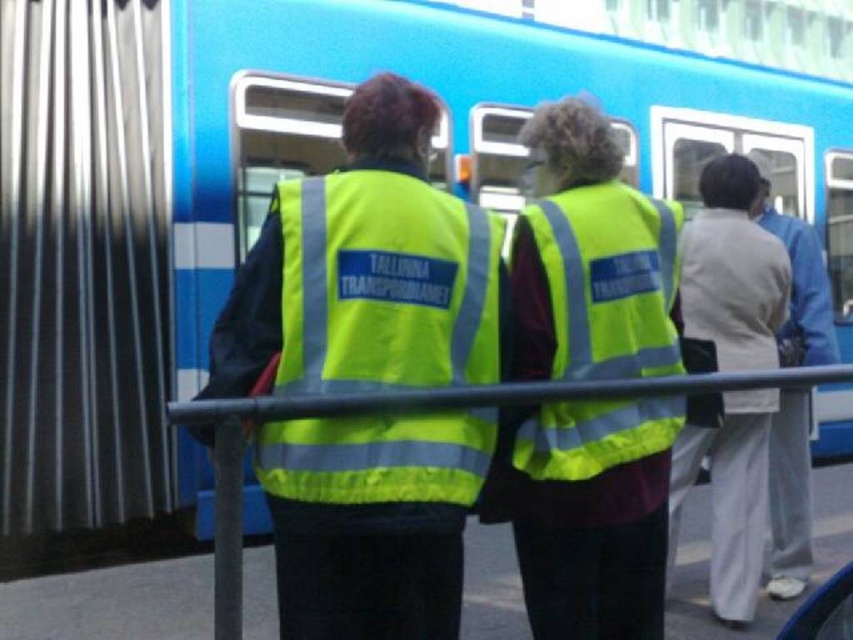
Can you confirm if white cotton pants at right is positioned above reflective plastic rail at center?

Yes.

Does point (740, 236) lie behind point (264, 406)?

Yes, point (740, 236) is behind point (264, 406).

The image size is (853, 640). Identify the location of white cotton pants at right. (732, 269).

Is neon yellow reflective vest at center thinner than white cotton pants at right?

In fact, neon yellow reflective vest at center might be wider than white cotton pants at right.

Between point (532, 548) and point (752, 400), which one is positioned in front?

Point (532, 548)

The height and width of the screenshot is (640, 853). Find the location of `neon yellow reflective vest at center`. neon yellow reflective vest at center is located at coordinates (592, 516).

Can you confirm if neon yellow reflective vest at center is positioned to the left of reflective plastic rail at center?

In fact, neon yellow reflective vest at center is to the right of reflective plastic rail at center.

Find the location of a particular element. This screenshot has width=853, height=640. neon yellow reflective vest at center is located at coordinates (592, 516).